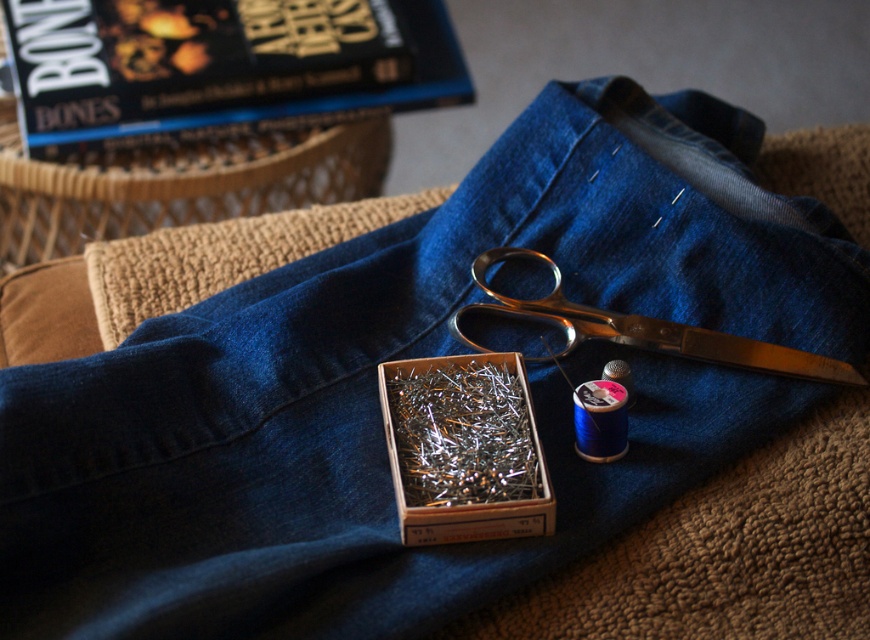
Which is more to the right, wooden box filled with pins at center or polished metal scissors at center?

polished metal scissors at center

Is point (419, 504) positioned before point (557, 285)?

Yes.

Which is behind, point (494, 412) or point (482, 268)?

Positioned behind is point (482, 268).

Where is `wooden box filled with pins at center`? The height and width of the screenshot is (640, 870). wooden box filled with pins at center is located at coordinates (464, 449).